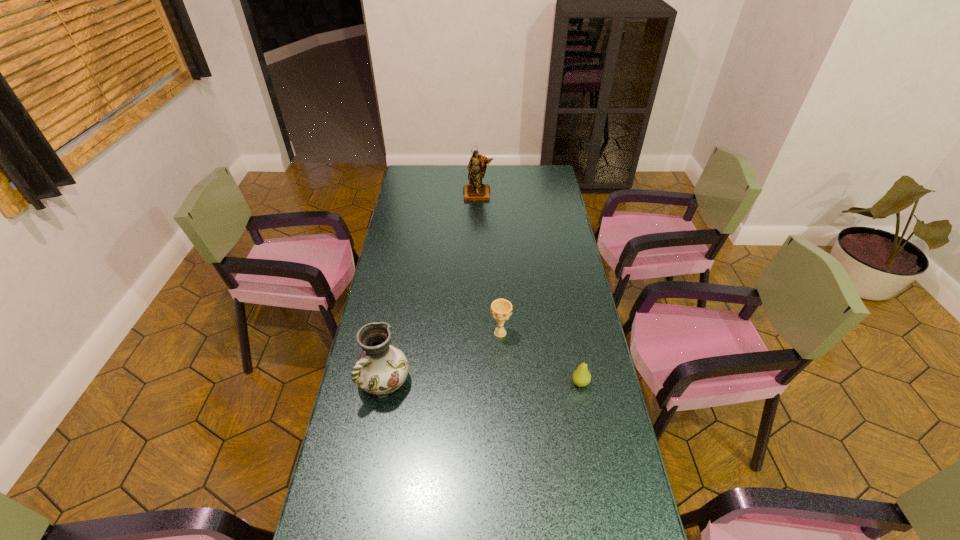
The width and height of the screenshot is (960, 540). Identify the location of the farthest object. (475, 190).

At what (x,y) coordinates should I click in order to perform the action: click on the leftmost object. Please return your answer as a coordinate pair (x, y). Looking at the image, I should click on (381, 369).

The image size is (960, 540). Find the location of `chalice`. chalice is located at coordinates coord(501,309).

You are a GUI agent. You are given a task and a screenshot of the screen. Output one action in this format:
    pyautogui.click(x=<x>, y=<y>)
    Task: Click on the second farthest object
    
    Given the screenshot: What is the action you would take?
    pyautogui.click(x=501, y=309)

At what (x,y) coordinates should I click in order to perform the action: click on pear. Please return your answer as a coordinate pair (x, y). Looking at the image, I should click on (581, 377).

In order to click on the shortest object in this screenshot , I will do 581,377.

Where is `vacant region located on the front-facing side of the farthest object`? The width and height of the screenshot is (960, 540). vacant region located on the front-facing side of the farthest object is located at coordinates (478, 242).

I want to click on free spot located on the right of the leftmost object, so click(476, 382).

Locate an element on the screen. This screenshot has height=540, width=960. free point located 0.210m on the left of the third nearest object is located at coordinates (433, 333).

At what (x,y) coordinates should I click in order to perform the action: click on free space located on the front of the pear. Please return your answer as a coordinate pair (x, y). The width and height of the screenshot is (960, 540). Looking at the image, I should click on (597, 467).